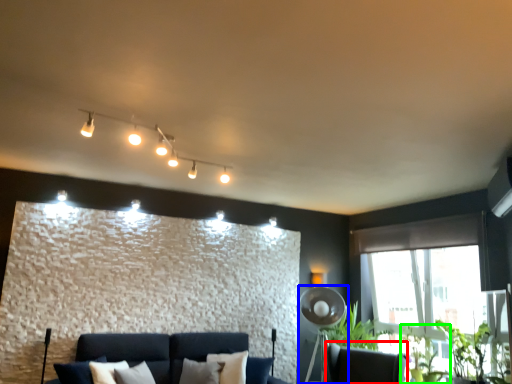
Question: Based on their relative distances, which object is nearer to swivel chair (highlighted by a red box)? Choose from fan (highlighted by a blue box) and plant (highlighted by a green box).

Choices:
 (A) fan
 (B) plant

Answer: (B)